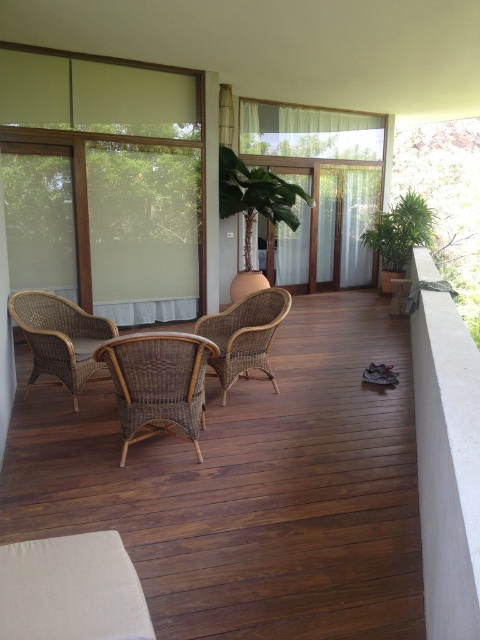
Between brown wicker chairs at center and woven rattan armchair at center, which one appears on the right side from the viewer's perspective?

From the viewer's perspective, woven rattan armchair at center appears more on the right side.

Between point (235, 506) and point (263, 316), which one is positioned behind?

The point (263, 316) is more distant.

Who is more forward, [233,410] or [289,305]?

Point [233,410] is in front.

Identify the location of brown wicker chairs at center. Image resolution: width=480 pixels, height=640 pixels. (248, 486).

Is woven rattan chair at left to the right of green leafy plant at right from the viewer's perspective?

In fact, woven rattan chair at left is to the left of green leafy plant at right.

This screenshot has width=480, height=640. In order to click on woven rattan chair at left in this screenshot , I will do `click(60, 337)`.

Does point (135, 390) come in front of point (280, 310)?

Yes, point (135, 390) is in front of point (280, 310).

Locate an element on the screen. Image resolution: width=480 pixels, height=640 pixels. woven rattan chair at center is located at coordinates (157, 384).